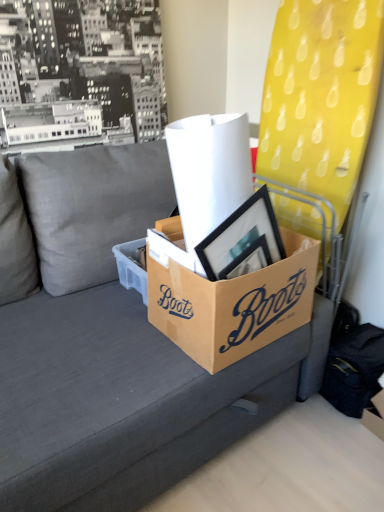
Image resolution: width=384 pixels, height=512 pixels. Describe the element at coordinates (208, 172) in the screenshot. I see `white paper at center` at that location.

What is the approximate width of black cardboard box at center?

It is 5.86 inches.

Where is `brown cardboard box at center, the 2th box when ordered from left to right`? This screenshot has height=512, width=384. brown cardboard box at center, the 2th box when ordered from left to right is located at coordinates tap(233, 304).

Looking at this image, which object is positioned more to the right, brown cardboard box at center, the second box when ordered from right to left, or gray fabric couch at center?

brown cardboard box at center, the second box when ordered from right to left, is more to the right.

From a real-world perspective, does brown cardboard box at center, the first box from the left, sit lower than gray fabric couch at center?

No, from a real-world perspective, brown cardboard box at center, the first box from the left, is not beneath gray fabric couch at center.

Does point (144, 256) come closer to viewer compared to point (211, 397)?

No, it is not.

Looking at this image, is the depth of brown cardboard box at center, the second box when ordered from right to left, less than that of gray fabric couch at center?

No, it is behind gray fabric couch at center.

From the image's perspective, is black cardboard box at center located above or below gray fabric couch at center?

Based on their image positions, black cardboard box at center is located above gray fabric couch at center.

Based on the photo, considering the relative positions of black cardboard box at center and gray fabric couch at center in the image provided, is black cardboard box at center to the left of gray fabric couch at center from the viewer's perspective?

No, black cardboard box at center is not to the left of gray fabric couch at center.

Is black cardboard box at center facing towards gray fabric couch at center?

Yes, black cardboard box at center is aimed at gray fabric couch at center.

From the image's perspective, between white paper at center and black cardboard box at center, who is located below?

From the image's view, black cardboard box at center is below.

Identify the location of paper towel above the black cardboard box at center (from the image's perspective). This screenshot has height=512, width=384. (208, 172).

Is there a large distance between white paper at center and black cardboard box at center?

That's not correct — white paper at center is a little close to black cardboard box at center.

Can you tell me how much white paper at center and black cardboard box at center differ in facing direction?

They differ by 2.98 degrees in their facing directions.

Considering the relative sizes of gray fabric couch at center and brown cardboard box at center, the second box when ordered from right to left, in the image provided, is gray fabric couch at center taller than brown cardboard box at center, the second box when ordered from right to left,?

Correct, gray fabric couch at center is much taller as brown cardboard box at center, the second box when ordered from right to left.

In the image, there is a brown cardboard box at center, the second box when ordered from right to left. Where is `studio couch below it (from the image's perspective)`? studio couch below it (from the image's perspective) is located at coordinates (117, 352).

From the image's perspective, is gray fabric couch at center beneath brown cardboard box at center, the second box when ordered from right to left?

Yes, from the image's perspective, gray fabric couch at center is beneath brown cardboard box at center, the second box when ordered from right to left.

Could you tell me if gray fabric couch at center is turned towards brown cardboard box at center, the second box when ordered from right to left?

Yes, gray fabric couch at center is facing brown cardboard box at center, the second box when ordered from right to left.

Is gray fabric couch at center wider or thinner than cardboard box at lower right?

In the image, gray fabric couch at center appears to be wider than cardboard box at lower right.

Which is further, (202,426) or (374,405)?

The point (374,405) is farther from the camera.

Which is behind, gray fabric couch at center or cardboard box at lower right?

cardboard box at lower right is behind.

In terms of height, does gray fabric couch at center look taller or shorter compared to cardboard box at lower right?

gray fabric couch at center is taller than cardboard box at lower right.

The width and height of the screenshot is (384, 512). I want to click on storage box below the brown cardboard box at center, which is counted as the 1th box, starting from the right (from the image's perspective), so click(375, 415).

Consider the image. Is brown cardboard box at center, the 2th box when ordered from left to right, in front of or behind cardboard box at lower right in the image?

brown cardboard box at center, the 2th box when ordered from left to right, is positioned closer to the viewer than cardboard box at lower right.

Is point (180, 273) positioned before point (381, 412)?

That is True.

In the scene shown: Can you confirm if brown cardboard box at center, which is counted as the 1th box, starting from the right, is shorter than cardboard box at lower right?

Incorrect, the height of brown cardboard box at center, which is counted as the 1th box, starting from the right, does not fall short of that of cardboard box at lower right.

Is brown cardboard box at center, the first box from the left, spatially inside black cardboard box at center, or outside of it?

brown cardboard box at center, the first box from the left, cannot be found inside black cardboard box at center.

From a real-world perspective, is brown cardboard box at center, the second box when ordered from right to left, positioned above or below black cardboard box at center?

brown cardboard box at center, the second box when ordered from right to left, is below black cardboard box at center.

Can you confirm if brown cardboard box at center, the first box from the left, is bigger than black cardboard box at center?

No, brown cardboard box at center, the first box from the left, is not bigger than black cardboard box at center.

You are a GUI agent. You are given a task and a screenshot of the screen. Output one action in this format:
    pyautogui.click(x=<x>, y=<y>)
    Task: Click on the box that is the 2nd one when counting backward from the gray fabric couch at center
    
    Given the screenshot: What is the action you would take?
    pyautogui.click(x=132, y=266)

The width and height of the screenshot is (384, 512). Identify the location of studio couch on the left of black cardboard box at center. (117, 352).

Based on their spatial positions, is black cardboard box at center or cardboard box at lower right closer to gray fabric couch at center?

Result: Based on the image, black cardboard box at center appears to be nearer to gray fabric couch at center.

Considering their positions, is white paper at center positioned closer to cardboard box at lower right than brown cardboard box at center, the first box from the left?

brown cardboard box at center, the first box from the left, is closer to cardboard box at lower right.

Estimate the real-world distances between objects in this image. Which object is closer to cardboard box at lower right, black cardboard box at center or brown cardboard box at center, which is counted as the 1th box, starting from the right?

black cardboard box at center.

Based on their spatial positions, is brown cardboard box at center, the first box from the left, or white paper at center closer to cardboard box at lower right?

Based on the image, brown cardboard box at center, the first box from the left, appears to be nearer to cardboard box at lower right.

From the image, which object appears to be nearer to white paper at center, brown cardboard box at center, which is counted as the 1th box, starting from the right, or gray fabric couch at center?

brown cardboard box at center, which is counted as the 1th box, starting from the right, lies closer to white paper at center than the other object.

Which object lies further to the anchor point cardboard box at lower right, gray fabric couch at center or brown cardboard box at center, the first box from the left?

The object further to cardboard box at lower right is brown cardboard box at center, the first box from the left.

Considering their positions, is white paper at center positioned further to brown cardboard box at center, which is counted as the 1th box, starting from the right, than brown cardboard box at center, the first box from the left?

Among the two, white paper at center is located further to brown cardboard box at center, which is counted as the 1th box, starting from the right.

Based on their spatial positions, is cardboard box at lower right or white paper at center further from gray fabric couch at center?

cardboard box at lower right lies further to gray fabric couch at center than the other object.

Where is `writing between gray fabric couch at center and cardboard box at lower right in the horizontal direction`? The image size is (384, 512). writing between gray fabric couch at center and cardboard box at lower right in the horizontal direction is located at coordinates (263, 309).

Find the location of `paper towel positioned between gray fabric couch at center and brown cardboard box at center, the first box from the left, from near to far`. paper towel positioned between gray fabric couch at center and brown cardboard box at center, the first box from the left, from near to far is located at coordinates (208, 172).

Find the location of `box located between white paper at center and cardboard box at lower right in the left-right direction`. box located between white paper at center and cardboard box at lower right in the left-right direction is located at coordinates (233, 304).

Locate an element on the screen. writing positioned between gray fabric couch at center and brown cardboard box at center, the 2th box when ordered from left to right, from near to far is located at coordinates (263, 309).